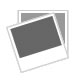
Where is `corners`? corners is located at coordinates (68, 58), (67, 10), (18, 10), (53, 13), (7, 27), (20, 71).